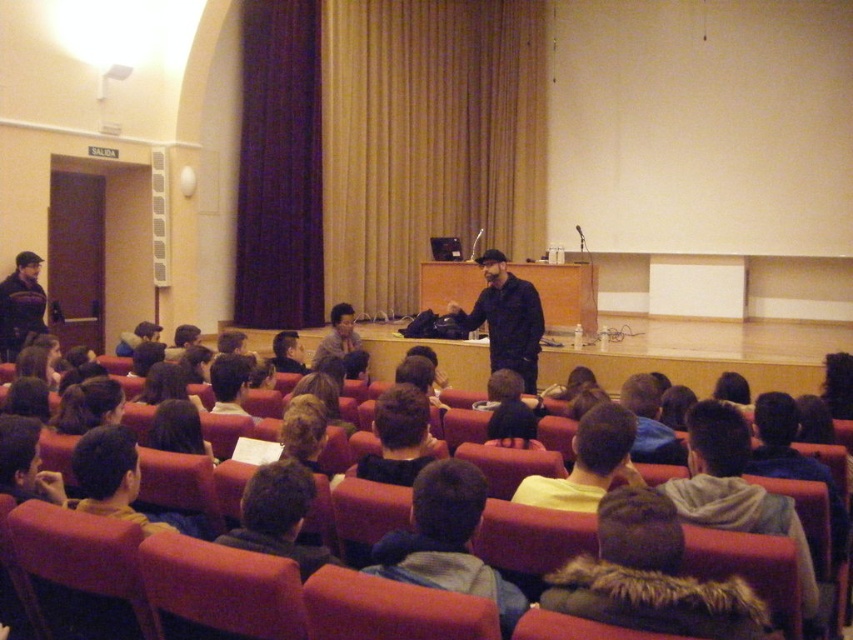
You are sitting in the lecture hall and want to determine which of the two points, point (630, 442) or point (525, 301), is closer to you. Based on the scene description, which point is nearer?

Point (630, 442) is closer to the viewer than point (525, 301).

You are a student sitting at point (587, 461) in the lecture hall. You need to hand in an assignment to the speaker at the front. Is the yellow cotton shirt at lower center in your immediate vicinity?

The yellow cotton shirt at lower center is located at point (587, 461), which is exactly where you are sitting, so it is in your immediate vicinity.